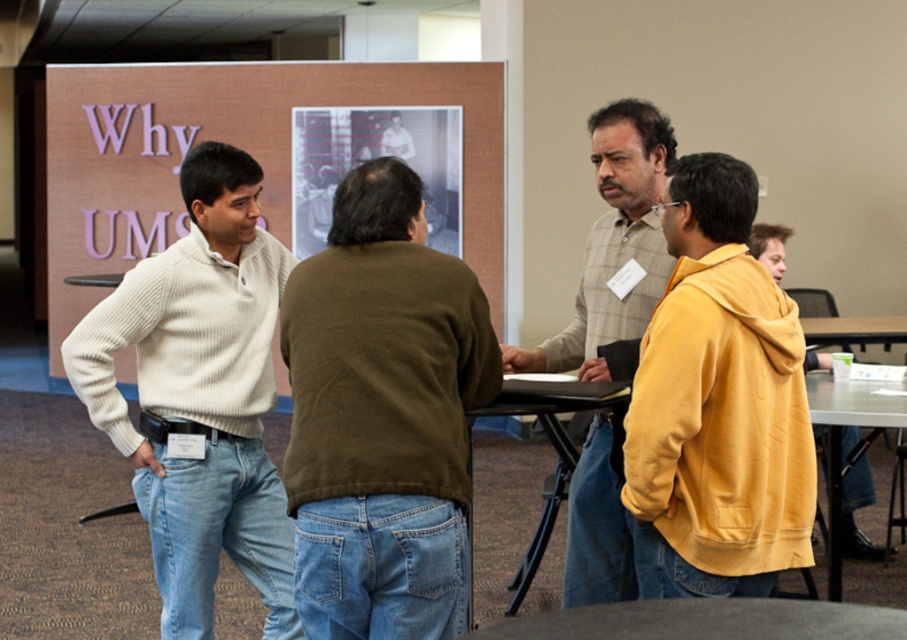
You are organizing a charity event and need to determine which sweater to donate based on size. Given the dark brown sweater at center and the white ribbed sweater at left, which one is smaller?

The dark brown sweater at center is smaller than the white ribbed sweater at left, so it would be the better choice for donation if a smaller size is needed.

In the conference room scene, there are several men standing around a table. You notice a point at coordinates (x=613, y=246). Which object from the list is located at that point? The options are the light brown plaid shirt at center and the brown jacket and blue jeans.

The point at coordinates (x=613, y=246) corresponds to the light brown plaid shirt at center.

You are standing in the conference room and need to locate the person wearing the light brown plaid shirt at center. According to the image, where exactly is this person positioned?

The light brown plaid shirt at center is located at point 0.386 on the x axis and 0.678 on the y axis.